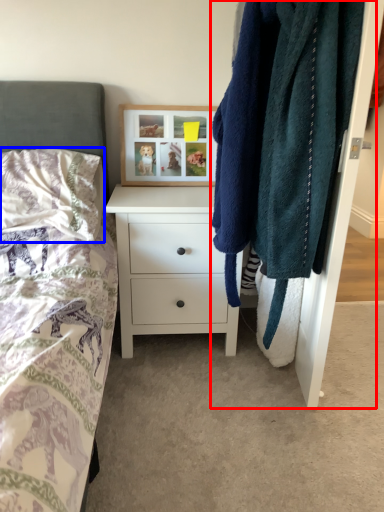
Question: Which object is further to the camera taking this photo, closet (highlighted by a red box) or pillow (highlighted by a blue box)?

Choices:
 (A) closet
 (B) pillow

Answer: (B)